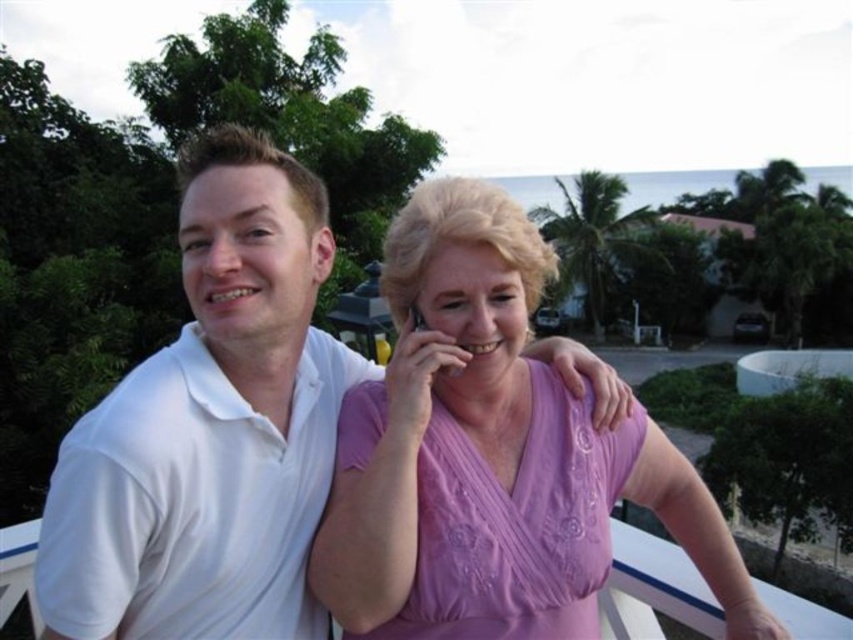
Is point (202, 385) positioned in front of point (381, 280)?

Yes.

The width and height of the screenshot is (853, 640). Identify the location of white smooth polo shirt at left. (210, 428).